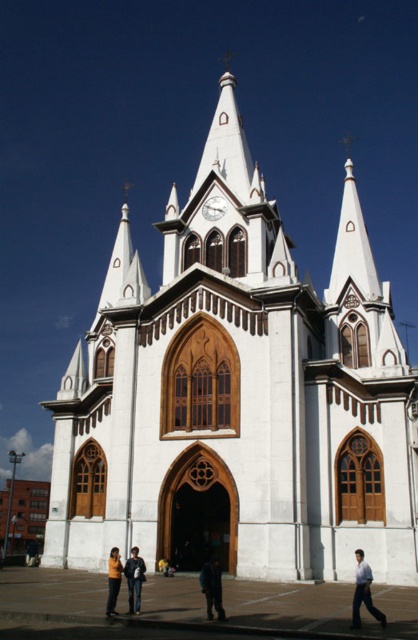
You are standing in front of the grand church with a dark blue fabric jacket at center and a camera. The camera is 99.43 feet away from the jacket. If you want to take a photo of the church spires using the camera, would you need to move closer or stay where you are?

The camera is 99.43 feet away from the dark blue fabric jacket at center. Since the church spires are part of the church structure, which is in front of you, and the jacket is at the center, you are already positioned at a sufficient distance to capture the spires in your photo. Therefore, you can stay where you are.

You are standing in front of the grand church and notice two jackets hanging on a rack near the entrance. The jackets are the dark blue fabric jacket at center and the yellow leather jacket at center. Which jacket is closer to the ground?

The dark blue fabric jacket at center is closer to the ground because it is positioned under the yellow leather jacket at center.